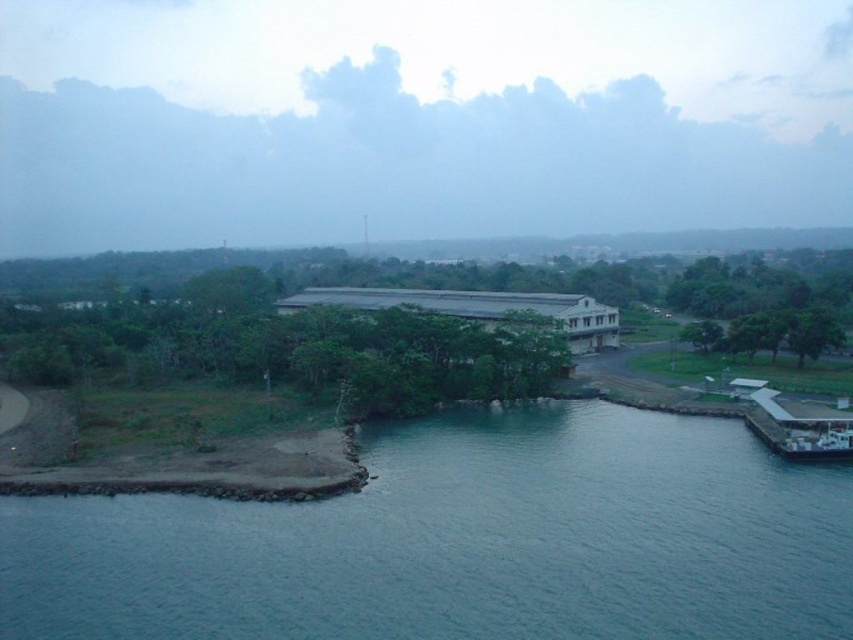
From the picture: Which of these two, blue water at lower left or white glossy ferry at lower right, stands shorter?

white glossy ferry at lower right is shorter.

Is blue water at lower left smaller than white glossy ferry at lower right?

Actually, blue water at lower left might be larger than white glossy ferry at lower right.

Where is `blue water at lower left`? blue water at lower left is located at coordinates (462, 541).